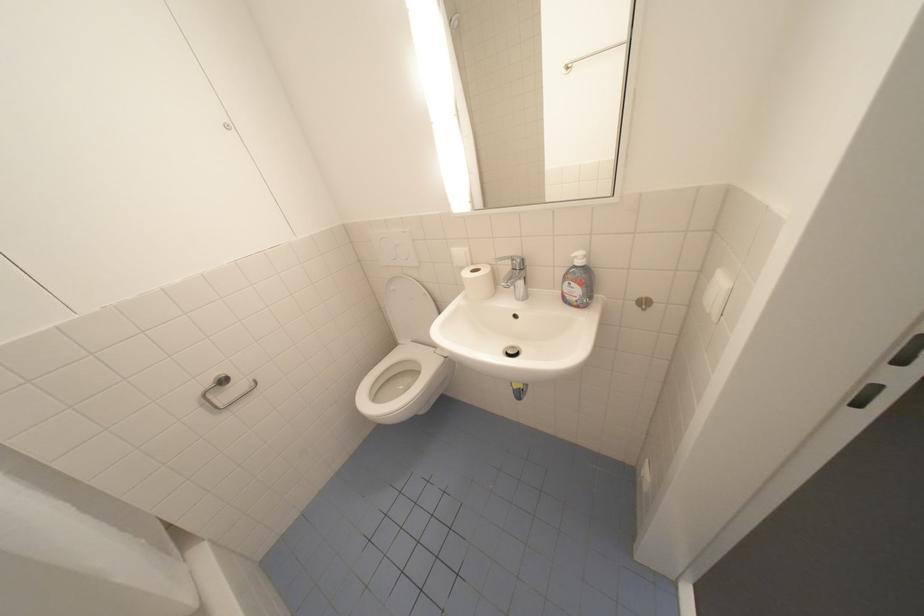
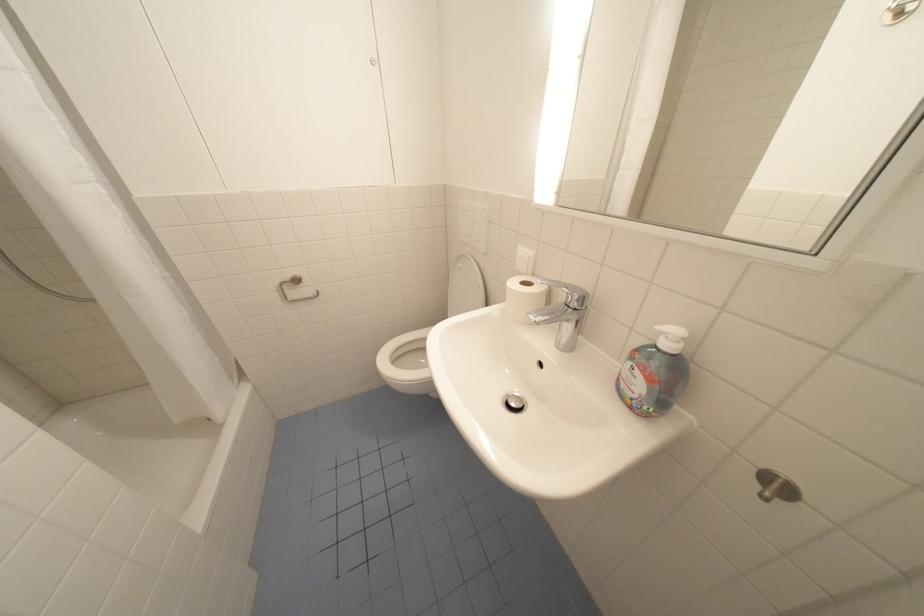
Find the pixel in the second image that matches [518,354] in the first image.

(520, 405)